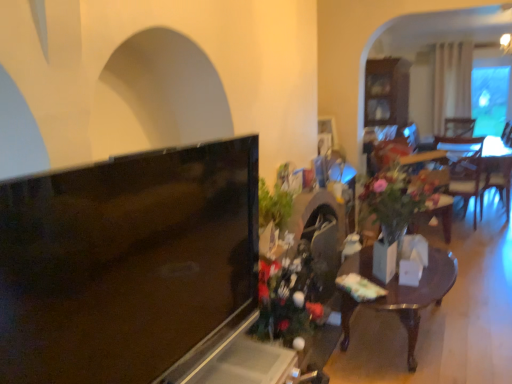
Question: Considering the relative sizes of matte black tv at left and white glossy vase at center in the image provided, is matte black tv at left bigger than white glossy vase at center?

Choices:
 (A) yes
 (B) no

Answer: (A)

Question: Is the surface of matte black tv at left in direct contact with white glossy vase at center?

Choices:
 (A) no
 (B) yes

Answer: (A)

Question: From the image's perspective, is matte black tv at left over white glossy vase at center?

Choices:
 (A) no
 (B) yes

Answer: (B)

Question: Is matte black tv at left to the left of white glossy vase at center from the viewer's perspective?

Choices:
 (A) no
 (B) yes

Answer: (B)

Question: From the image's perspective, is matte black tv at left below white glossy vase at center?

Choices:
 (A) no
 (B) yes

Answer: (A)

Question: From a real-world perspective, is wooden table at center positioned above or below matte black tv at left?

Choices:
 (A) below
 (B) above

Answer: (A)

Question: Considering the positions of wooden table at center and matte black tv at left in the image, is wooden table at center wider or thinner than matte black tv at left?

Choices:
 (A) thin
 (B) wide

Answer: (B)

Question: From the image's perspective, relative to matte black tv at left, is wooden table at center above or below?

Choices:
 (A) below
 (B) above

Answer: (A)

Question: Is wooden table at center bigger or smaller than matte black tv at left?

Choices:
 (A) big
 (B) small

Answer: (A)

Question: From a real-world perspective, is matte black tv at left above or below green leafy plant at center-right?

Choices:
 (A) above
 (B) below

Answer: (A)

Question: Which is correct: matte black tv at left is inside green leafy plant at center-right, or outside of it?

Choices:
 (A) outside
 (B) inside

Answer: (A)

Question: Considering the relative positions of matte black tv at left and green leafy plant at center-right in the image provided, is matte black tv at left to the left or to the right of green leafy plant at center-right?

Choices:
 (A) left
 (B) right

Answer: (A)

Question: From the image's perspective, is matte black tv at left above or below green leafy plant at center-right?

Choices:
 (A) below
 (B) above

Answer: (A)

Question: From the image's perspective, is green leafy plant at center-right positioned above or below matte black tv at left?

Choices:
 (A) above
 (B) below

Answer: (A)

Question: Is point (423, 205) closer or farther from the camera than point (9, 230)?

Choices:
 (A) farther
 (B) closer

Answer: (A)